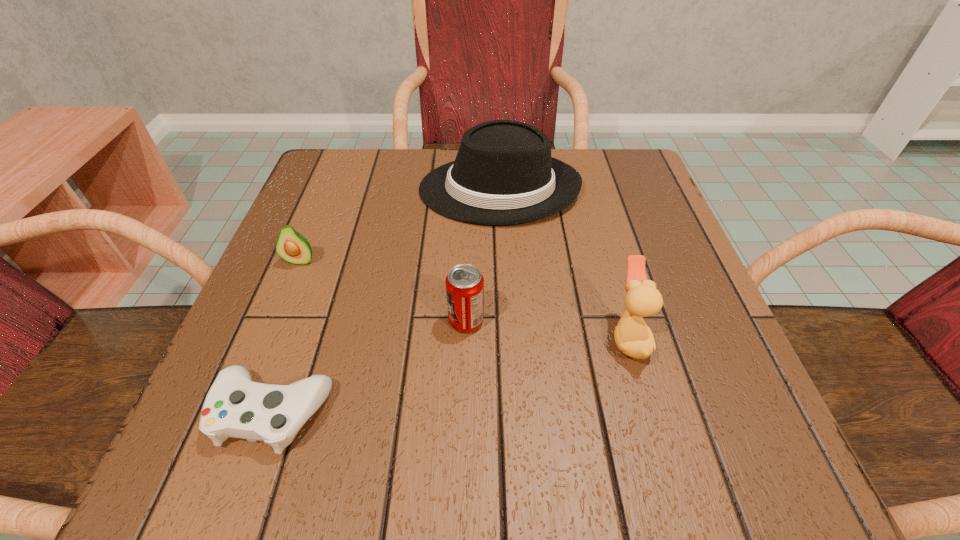
The height and width of the screenshot is (540, 960). Find the location of `fedora`. fedora is located at coordinates (503, 174).

In order to click on duck in this screenshot , I will do `click(633, 337)`.

Where is `soda can`? soda can is located at coordinates (464, 283).

Find the location of a particular element. The image size is (960, 540). the second farthest object is located at coordinates (293, 247).

Find the location of a particular element. the fourth tallest object is located at coordinates (293, 247).

This screenshot has height=540, width=960. I want to click on control, so click(x=235, y=406).

The width and height of the screenshot is (960, 540). I want to click on blank area located on the front-facing side of the fedora, so click(x=363, y=189).

In order to click on free space located on the front-facing side of the fedora in this screenshot , I will do coord(335,189).

This screenshot has height=540, width=960. What are the coordinates of `free point located 0.190m on the front-facing side of the fedora` in the screenshot? It's located at (330, 189).

Locate an element on the screen. The width and height of the screenshot is (960, 540). free space located on the beak of the duck is located at coordinates (466, 338).